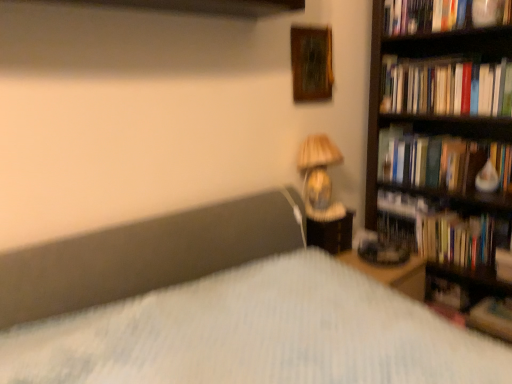
Where is `vacant space situated above hardcover books at right, the second book viewed from the top (from a real-world perspective)`? This screenshot has height=384, width=512. vacant space situated above hardcover books at right, the second book viewed from the top (from a real-world perspective) is located at coordinates (442, 65).